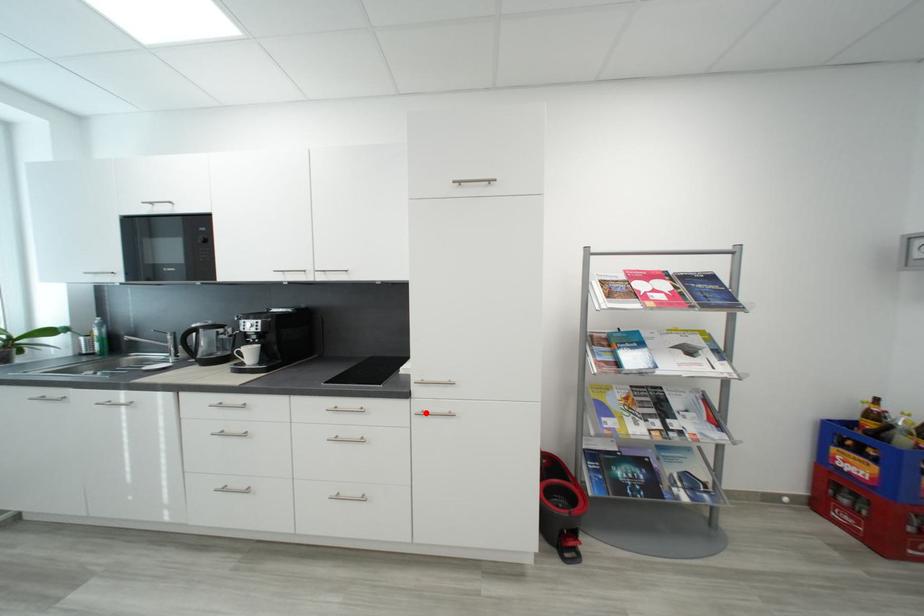
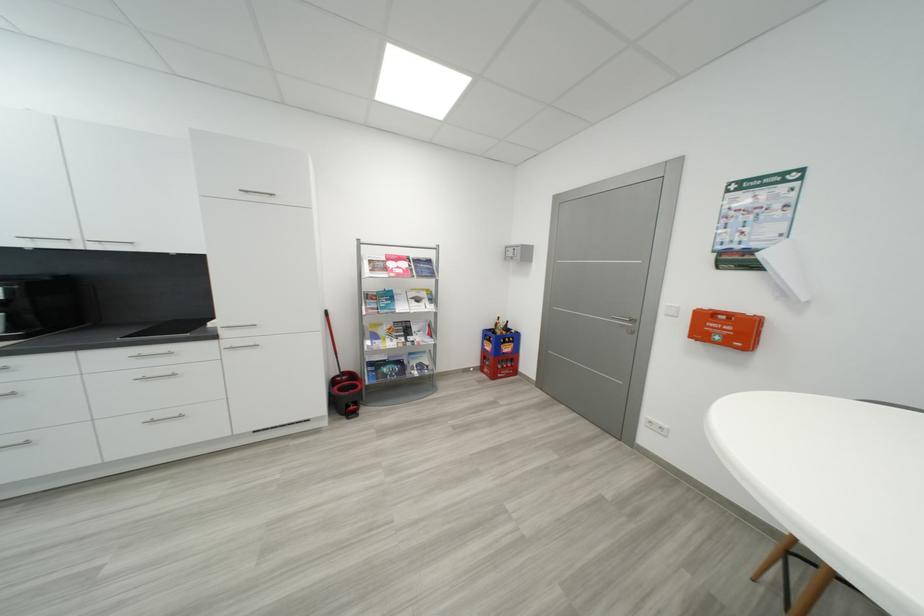
Where in the second image is the point corresponding to the highlighted location from the first image?

(235, 349)